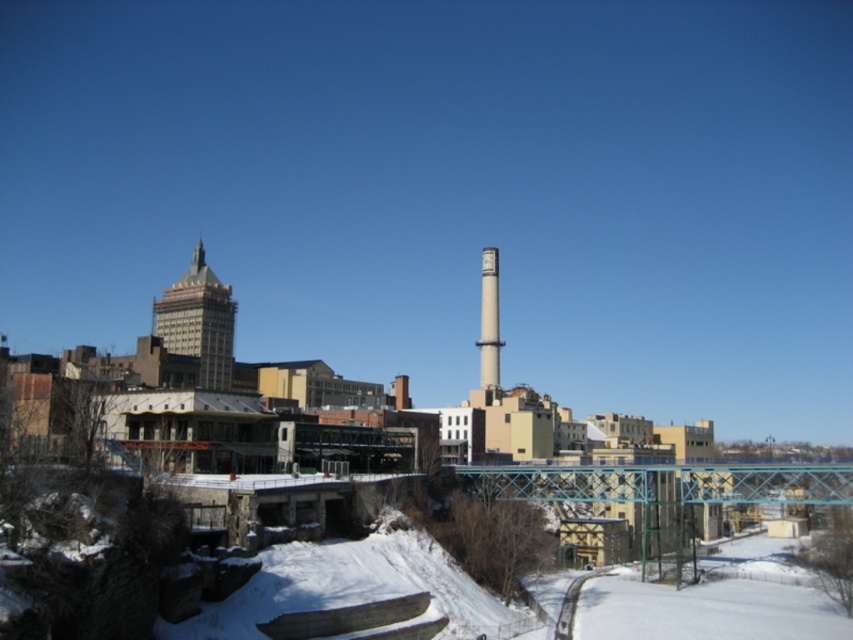
You are standing at the center of the snow path in the urban winter scene. You see a point marked at coordinates (198, 321). Which building does this point indicate?

The point at coordinates (198, 321) corresponds to the gold textured building at upper left.

You are an architect analyzing the urban layout. You observe the gold textured building at upper left and the smooth concrete tower at center. Which of these two structures is positioned to the west if the image is oriented with north at the top?

The gold textured building at upper left is to the left of the smooth concrete tower at center. Since the image is oriented with north at the top, left corresponds to west. Therefore, the gold textured building at upper left is positioned to the west.